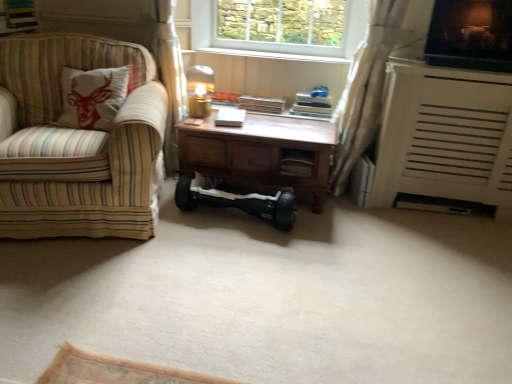
In order to click on vacant space positioned to the left of black rubber hoverboard at center in this screenshot , I will do `click(157, 227)`.